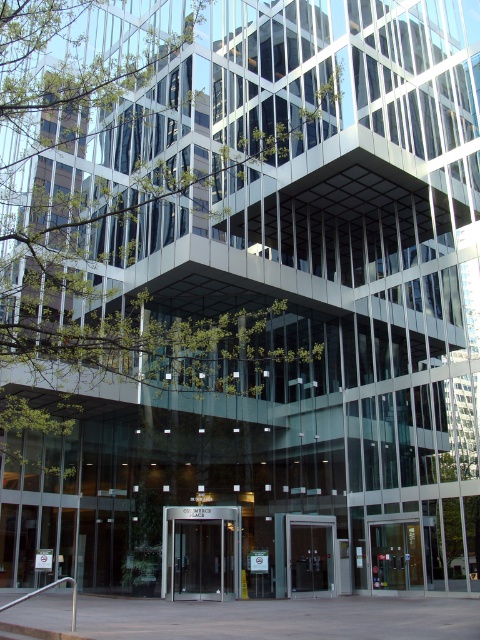
You are standing in front of the building and want to enter through the doors. Which door should you approach first, the dark brown glass door at center or the matte glass door at center?

You should approach the dark brown glass door at center first because it is closer to you than the matte glass door at center.

You are a delivery person approaching the entrance of Commerce Place. You see the dark brown glass door at center and the matte glass door at center. Which door is above the other?

The dark brown glass door at center is positioned over the matte glass door at center.

You are a delivery person with a cart that is 1.5 meters wide. You need to enter the building through the entrance. The entrance has two doors, a dark brown glass door at center and a matte glass door at center. Can your cart fit through the space between them?

The dark brown glass door at center is 6.72 meters away from the matte glass door at center. Since the cart is only 1.5 meters wide, it can easily fit through the space between them.